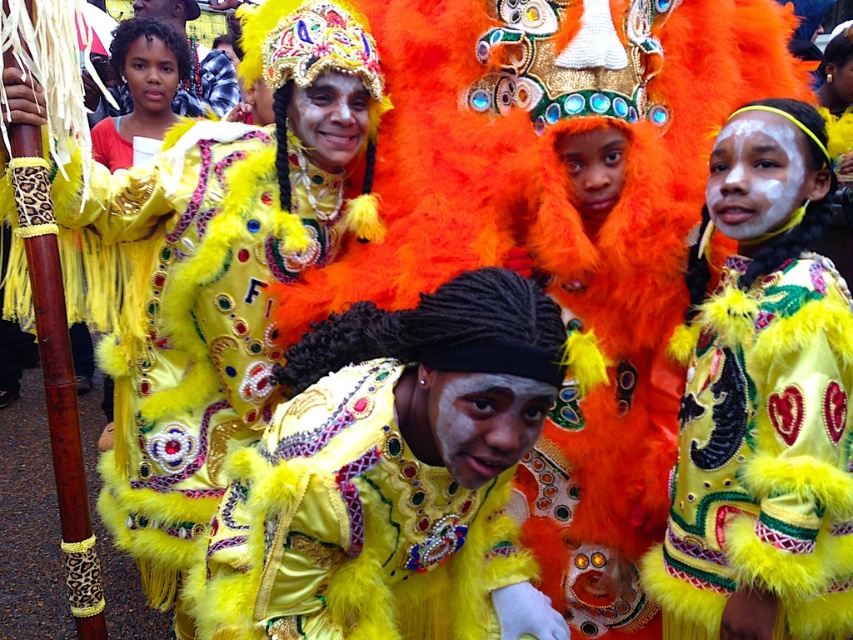
In the festive scene, you notice two items of clothing. The yellow fuzzy jacket at center and the shiny yellow feathered costume at upper left. Which one is positioned to the right of the other?

The yellow fuzzy jacket at center is positioned to the right of the shiny yellow feathered costume at upper left.

You are a photographer trying to capture the best shot of the shiny yellow feathered outfit at center and the shiny yellow feathered costume at upper left. Which one should you focus on first if you want to take a photo that includes both in the frame without moving the camera?

You should focus on the shiny yellow feathered outfit at center first because it is closer to the viewer, so it will appear larger in the frame. To include both in the frame without moving the camera, you can adjust the focus to ensure both are in the same plane or use a wide aperture to keep both in focus.

You are a photographer at the event and want to capture both the shiny yellow feathered outfit at center and the yellow fuzzy jacket at center in a single frame. Which object should you position closer to the camera to ensure both are fully visible?

To ensure both the shiny yellow feathered outfit at center and the yellow fuzzy jacket at center are fully visible in the frame, position the wider shiny yellow feathered outfit at center closer to the camera. Since it is wider than the yellow fuzzy jacket at center, placing it closer will help maintain the balance in the composition without cropping either subject.